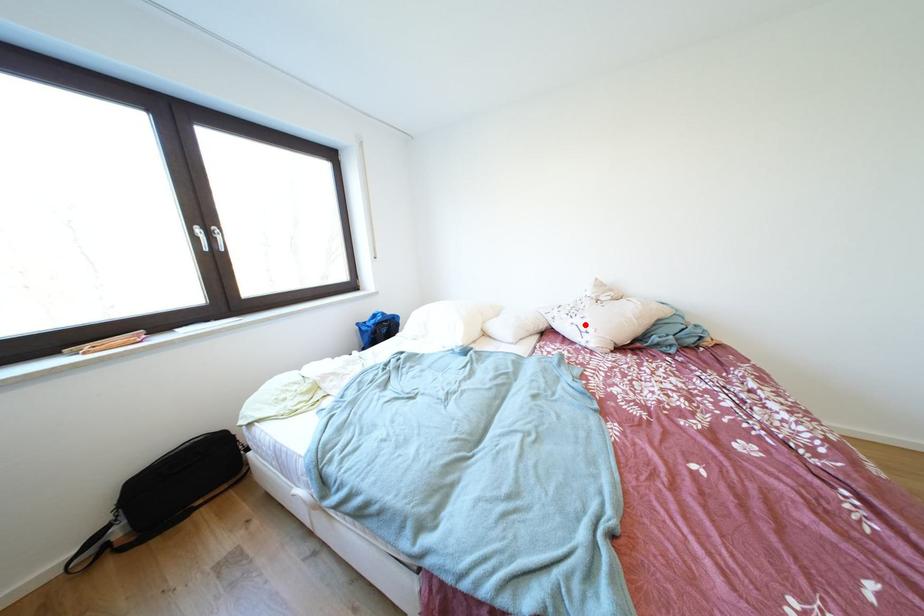
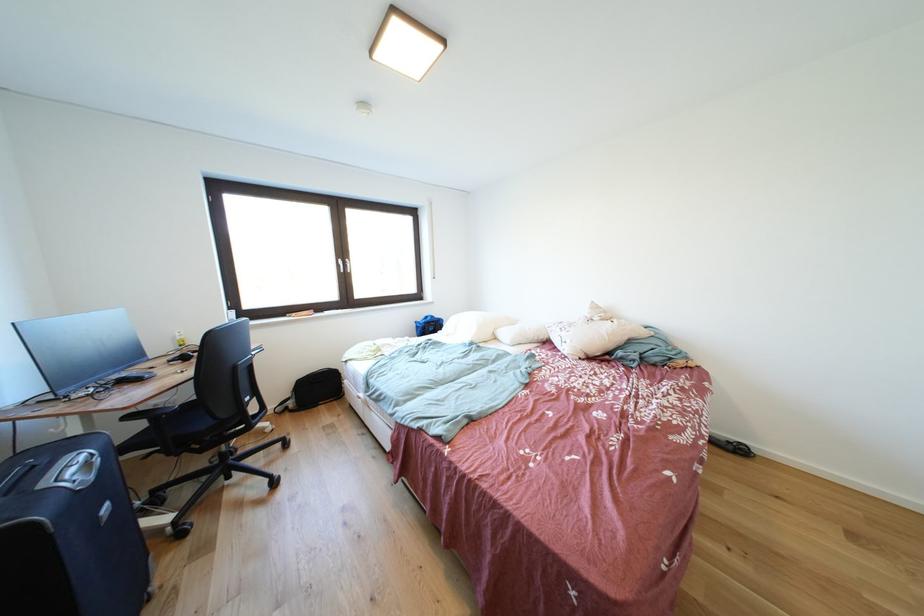
Question: I am providing you with two images of the same scene from different viewpoints. Given a red point in image1, look at the same physical point in image2. Is it:

Choices:
 (A) Closer to the viewpoint
 (B) Farther from the viewpoint

Answer: (A)